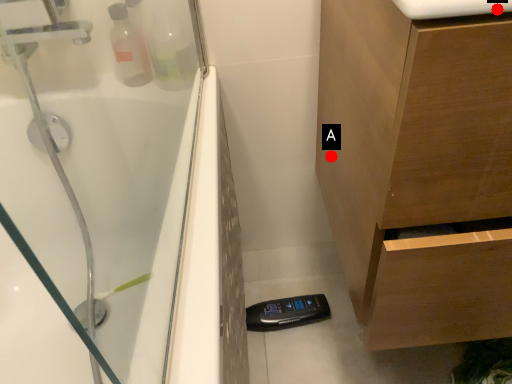
Question: Two points are circled on the image, labeled by A and B beside each circle. Which point appears farthest from the camera in this image?

Choices:
 (A) A is further
 (B) B is further

Answer: (A)